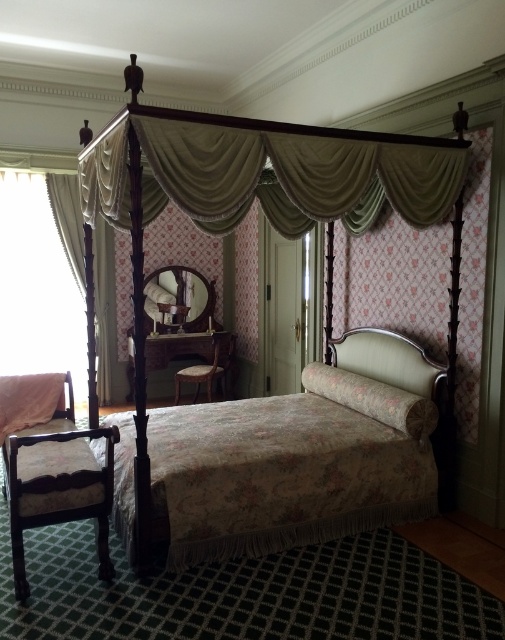
Is point (429, 468) farther from viewer compared to point (177, 148)?

Yes, point (429, 468) is behind point (177, 148).

Does floral fabric bed at center have a lesser width compared to floral fabric canopy bed at center?

Yes.

Is point (242, 504) positioned in front of point (139, 364)?

No, (242, 504) is further to viewer.

Locate an element on the screen. The width and height of the screenshot is (505, 640). floral fabric bed at center is located at coordinates (294, 460).

Which of these two, floral fabric bed at center or matte cream headboard at center, stands taller?

Standing taller between the two is floral fabric bed at center.

Which is more to the right, floral fabric bed at center or matte cream headboard at center?

matte cream headboard at center

Where is `floral fabric bed at center`? This screenshot has width=505, height=640. floral fabric bed at center is located at coordinates (294, 460).

Locate an element on the screen. The height and width of the screenshot is (640, 505). floral fabric bed at center is located at coordinates (294, 460).

Is floral fabric bed at center shorter than white sheer curtain at left?

Yes, floral fabric bed at center is shorter than white sheer curtain at left.

Is point (226, 509) farther from viewer compared to point (95, 300)?

No, it is in front of (95, 300).

What do you see at coordinates (294, 460) in the screenshot? Image resolution: width=505 pixels, height=640 pixels. I see `floral fabric bed at center` at bounding box center [294, 460].

This screenshot has width=505, height=640. Identify the location of floral fabric bed at center. (294, 460).